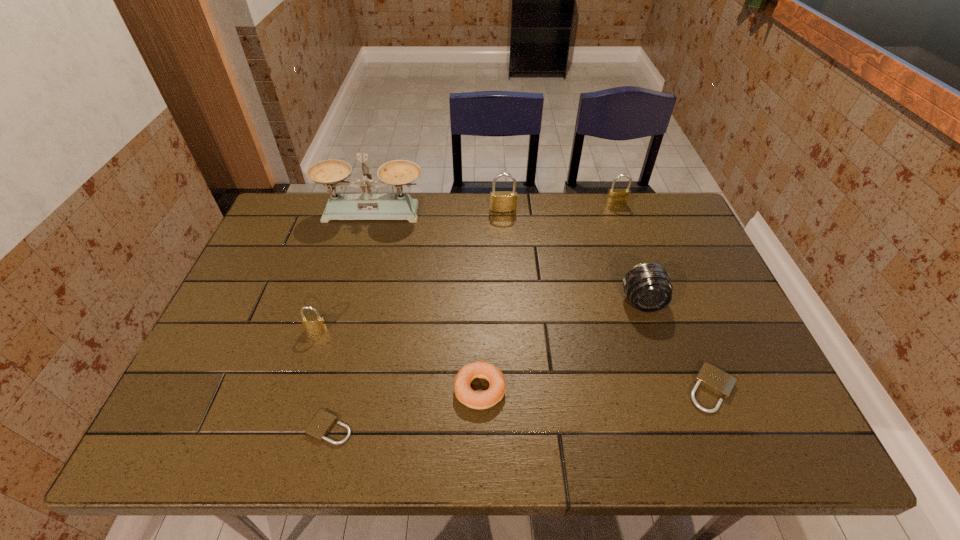
Image resolution: width=960 pixels, height=540 pixels. Find the location of `free location that satisfies the following two spatial constraints: 1. at the front element of the seventh tallest object; 2. on the left side of the fourth farthest object`. free location that satisfies the following two spatial constraints: 1. at the front element of the seventh tallest object; 2. on the left side of the fourth farthest object is located at coordinates (671, 389).

Locate an element on the screen. free space that satisfies the following two spatial constraints: 1. on the front-facing side of the scale; 2. on the right side of the third shortest object is located at coordinates (324, 389).

Locate an element on the screen. This screenshot has height=540, width=960. free location that satisfies the following two spatial constraints: 1. on the front-facing side of the second shortest object; 2. on the left side of the fourth shortest padlock is located at coordinates (681, 389).

Image resolution: width=960 pixels, height=540 pixels. Identify the location of vacant area in the image that satisfies the following two spatial constraints: 1. on the front-facing side of the fourth tallest padlock; 2. on the left side of the tallest padlock. (514, 389).

Where is `vacant space that satisfies the following two spatial constraints: 1. on the front-facing side of the bigger beige padlock; 2. on the right side of the second tallest padlock`? The height and width of the screenshot is (540, 960). vacant space that satisfies the following two spatial constraints: 1. on the front-facing side of the bigger beige padlock; 2. on the right side of the second tallest padlock is located at coordinates (681, 389).

Find the location of `free space that satisfies the following two spatial constraints: 1. at the front element of the telephoto lens; 2. on the right side of the second shortest object`. free space that satisfies the following two spatial constraints: 1. at the front element of the telephoto lens; 2. on the right side of the second shortest object is located at coordinates (671, 389).